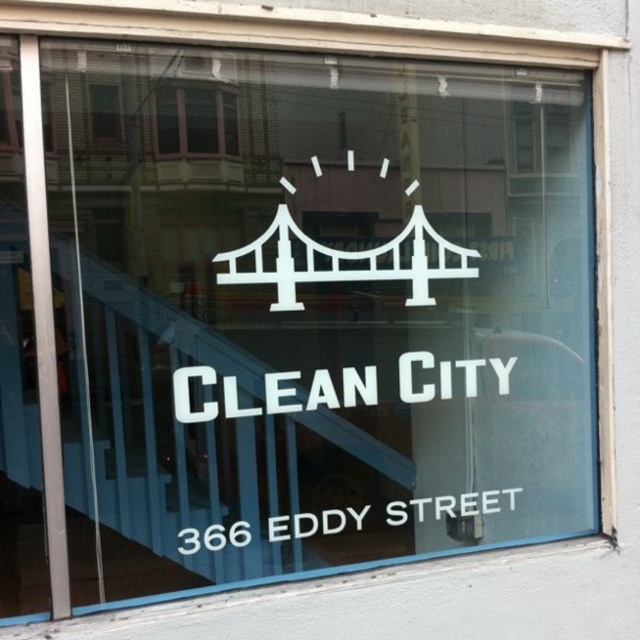
Is white matte bridge at center smaller than white vinyl sign at lower center?

No.

Identify the location of white matte bridge at center. This screenshot has height=640, width=640. (346, 260).

Does white matte bridge at center appear on the right side of clear glass window at upper center?

Indeed, white matte bridge at center is positioned on the right side of clear glass window at upper center.

Does white matte bridge at center have a lesser width compared to clear glass window at upper center?

No, white matte bridge at center is not thinner than clear glass window at upper center.

Does point (396, 250) come behind point (164, 109)?

Yes, it is behind point (164, 109).

Identify the location of white matte bridge at center. (346, 260).

Between point (173, 396) and point (195, 90), which one is positioned behind?

Point (173, 396)

Identify the location of white matte sign at center. Image resolution: width=640 pixels, height=640 pixels. (269, 392).